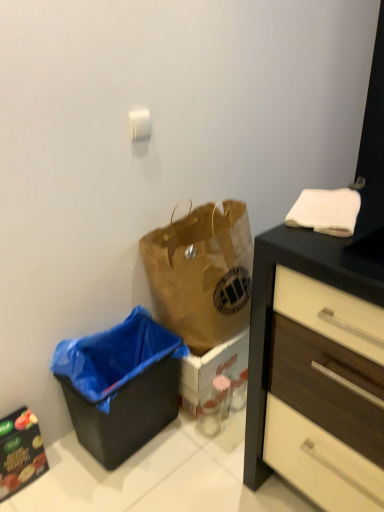
Question: Is black glossy cabinet at lower left looking in the opposite direction of brown paper bag at center?

Choices:
 (A) no
 (B) yes

Answer: (A)

Question: Is black glossy cabinet at lower left located outside brown paper bag at center?

Choices:
 (A) no
 (B) yes

Answer: (B)

Question: From the image's perspective, is black glossy cabinet at lower left on brown paper bag at center?

Choices:
 (A) no
 (B) yes

Answer: (A)

Question: Would you say brown paper bag at center is part of black glossy cabinet at lower left's contents?

Choices:
 (A) no
 (B) yes

Answer: (A)

Question: Can you confirm if black glossy cabinet at lower left is bigger than brown paper bag at center?

Choices:
 (A) no
 (B) yes

Answer: (A)

Question: From the image's perspective, is black glossy cabinet at lower left beneath brown paper bag at center?

Choices:
 (A) yes
 (B) no

Answer: (A)

Question: From the image's perspective, is black plastic recycling bin at lower left under black glossy cabinet at lower left?

Choices:
 (A) no
 (B) yes

Answer: (A)

Question: Can you confirm if black plastic recycling bin at lower left is bigger than black glossy cabinet at lower left?

Choices:
 (A) no
 (B) yes

Answer: (B)

Question: Can you confirm if black plastic recycling bin at lower left is positioned to the right of black glossy cabinet at lower left?

Choices:
 (A) no
 (B) yes

Answer: (B)

Question: Is black plastic recycling bin at lower left not near black glossy cabinet at lower left?

Choices:
 (A) yes
 (B) no

Answer: (B)

Question: Is black plastic recycling bin at lower left outside black glossy cabinet at lower left?

Choices:
 (A) no
 (B) yes

Answer: (B)

Question: Is black plastic recycling bin at lower left aimed at black glossy cabinet at lower left?

Choices:
 (A) yes
 (B) no

Answer: (B)

Question: Is brown paper bag at center not inside black glossy cabinet at lower left?

Choices:
 (A) yes
 (B) no

Answer: (A)